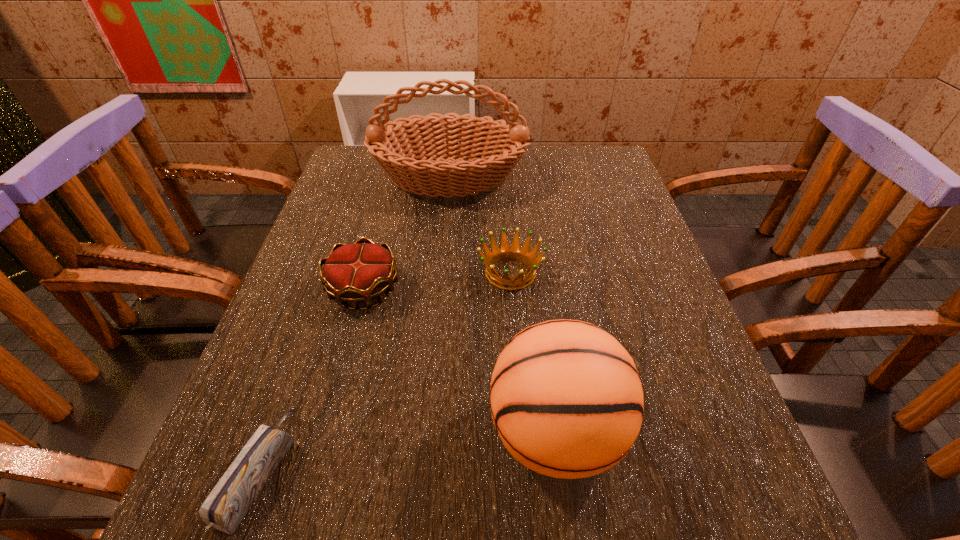
Image resolution: width=960 pixels, height=540 pixels. In the image, there is a desktop. What are the coordinates of `vacant space at the near edge` in the screenshot? It's located at (492, 525).

Locate an element on the screen. free point at the left edge is located at coordinates (368, 220).

This screenshot has height=540, width=960. Identify the location of vacant space at the right edge of the desktop. (623, 259).

The image size is (960, 540). Identify the location of vacant area at the far left corner. (356, 184).

You are a GUI agent. You are given a task and a screenshot of the screen. Output one action in this format:
    pyautogui.click(x=<x>, y=<y>)
    Task: Click on the vacant space at the far right corner of the desktop
    
    Given the screenshot: What is the action you would take?
    pyautogui.click(x=615, y=167)

You are a GUI agent. You are given a task and a screenshot of the screen. Output one action in this format:
    pyautogui.click(x=<x>, y=<y>)
    Task: Click on the vacant area that lies between the left crown and the second tallest object
    This screenshot has height=540, width=960.
    Given the screenshot: What is the action you would take?
    pyautogui.click(x=460, y=361)

Locate an element on the screen. vacant area that lies between the left crown and the fourth shortest object is located at coordinates pos(460,361).

Locate an element on the screen. The width and height of the screenshot is (960, 540). free space that is in between the left crown and the pencil box is located at coordinates (311, 380).

This screenshot has height=540, width=960. In order to click on empty location between the left crown and the basketball in this screenshot , I will do `click(460, 361)`.

The height and width of the screenshot is (540, 960). In order to click on vacant area that lies between the basketball and the pencil box in this screenshot , I will do `click(407, 451)`.